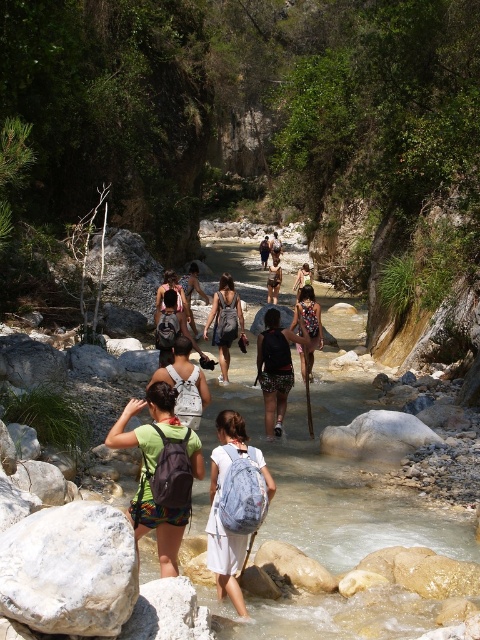
You are a hiker carrying a matte gray backpack at center and want to cross the clear water stream at center. Which direction should you move to reach the stream from your current position?

The clear water stream at center is positioned on the right side of the matte gray backpack at center, so you should move to your right to reach the stream.

You are a hiker carrying a matte black backpack at center and want to cross the clear water stream at center. Can you step directly from your current position onto the stream without moving the backpack?

The clear water stream at center is below matte black backpack at center, so stepping directly from your current position onto the stream would require moving the backpack first.